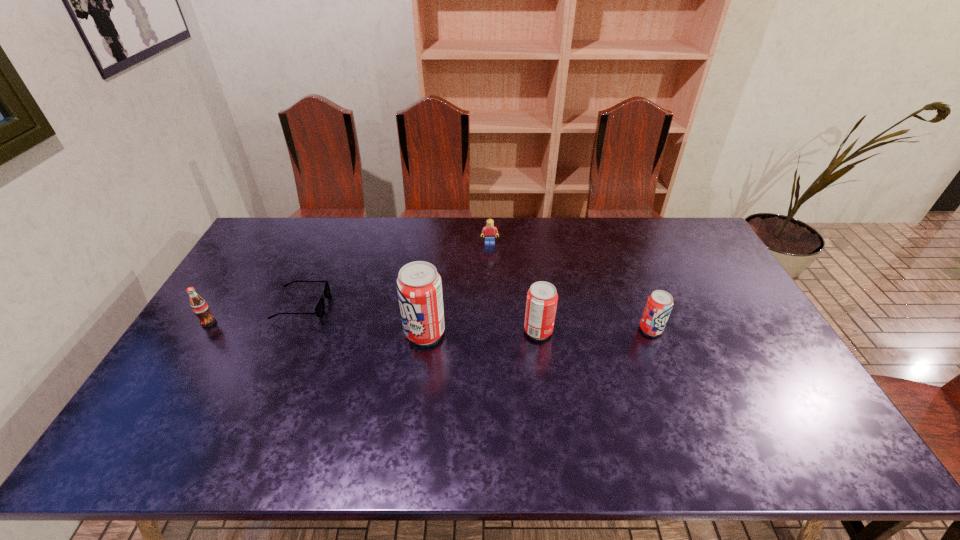
Find the location of a particular element. This screenshot has height=540, width=960. vacant space located 0.400m on the back of the third soda from right to left is located at coordinates (437, 239).

Where is `vacant area situated on the back of the second tallest soda`? This screenshot has height=540, width=960. vacant area situated on the back of the second tallest soda is located at coordinates (531, 276).

At what (x,y) coordinates should I click in order to perform the action: click on vacant space located 0.340m on the left of the rightmost object. Please return your answer as a coordinate pair (x, y). Looking at the image, I should click on (523, 329).

Where is `blank space located on the front-facing side of the fifth tallest object`? The height and width of the screenshot is (540, 960). blank space located on the front-facing side of the fifth tallest object is located at coordinates (491, 288).

The height and width of the screenshot is (540, 960). I want to click on free location located 0.110m on the front-facing side of the spectacles, so click(363, 305).

Where is `vacant space located 0.400m on the back of the leftmost object`? The height and width of the screenshot is (540, 960). vacant space located 0.400m on the back of the leftmost object is located at coordinates (261, 239).

Find the location of `object present at the far edge`. object present at the far edge is located at coordinates (489, 230).

The width and height of the screenshot is (960, 540). In order to click on object that is at the left edge in this screenshot , I will do `click(199, 306)`.

Where is `blank space at the far edge`? This screenshot has width=960, height=540. blank space at the far edge is located at coordinates (317, 231).

This screenshot has width=960, height=540. I want to click on vacant position at the near edge of the desktop, so click(719, 417).